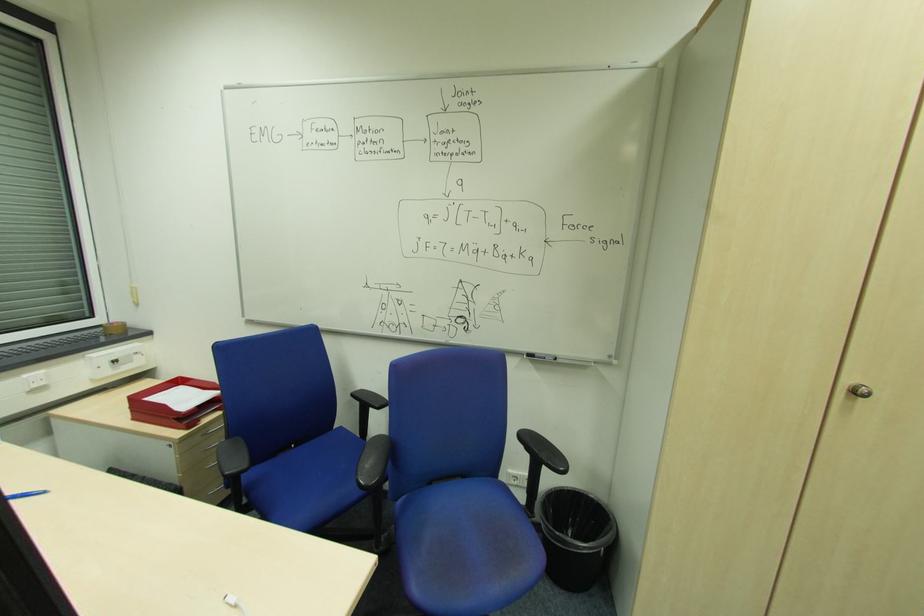
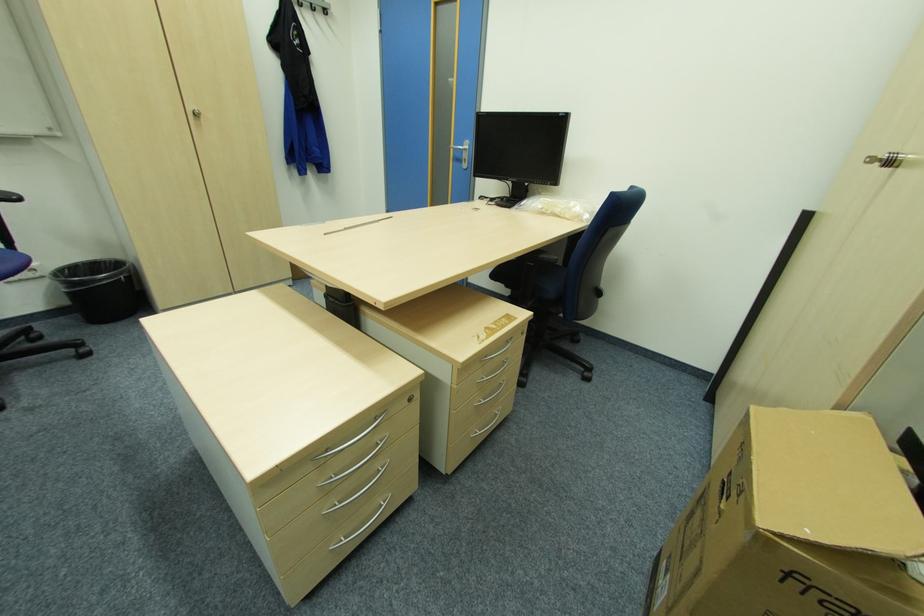
Locate, in the second image, the point that corresponds to the point at 594,499 in the first image.

(113, 261)